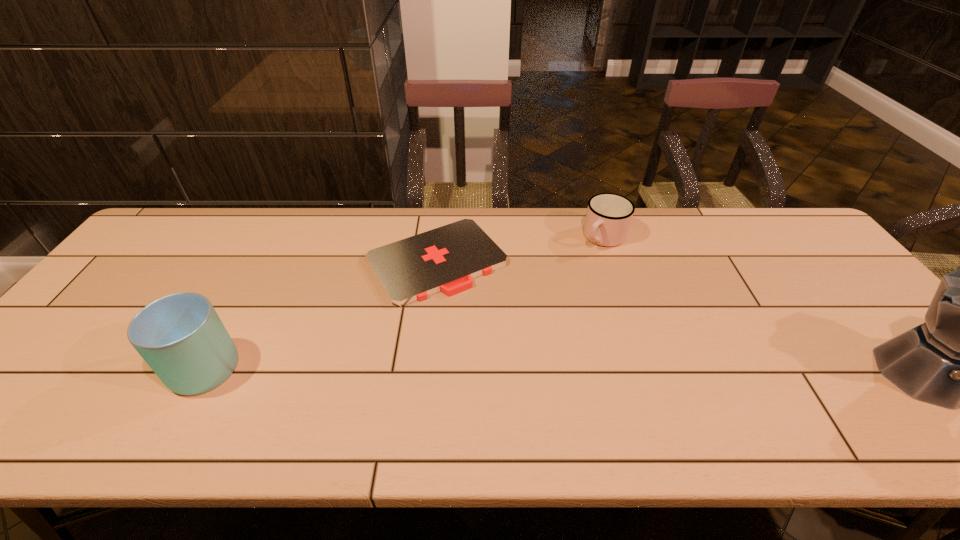
You are a GUI agent. You are given a task and a screenshot of the screen. Output one action in this format:
    pyautogui.click(x=<x>, y=<y>)
    Task: Click on the free space located 0.080m on handle side the first-aid kit
    This screenshot has width=960, height=540.
    Given the screenshot: What is the action you would take?
    pyautogui.click(x=486, y=320)

Locate an element on the screen. free spot located on handle side the first-aid kit is located at coordinates (510, 349).

At what (x,y) coordinates should I click in order to perform the action: click on vacant space situated 0.300m on handle side the first-aid kit. Please return your answer as a coordinate pair (x, y). This screenshot has width=960, height=540. Looking at the image, I should click on (536, 383).

The image size is (960, 540). Identify the location of mug that is positioned at the far edge. (609, 215).

The height and width of the screenshot is (540, 960). I want to click on the first-aid kit at the far edge, so click(x=446, y=259).

At what (x,y) coordinates should I click in order to perform the action: click on object present at the near edge. Please return your answer as a coordinate pair (x, y). Looking at the image, I should click on (180, 336).

Where is `vacant area at the far edge of the desktop`? vacant area at the far edge of the desktop is located at coordinates (370, 229).

Where is `vacant position at the near edge of the desktop`? The image size is (960, 540). vacant position at the near edge of the desktop is located at coordinates (420, 392).

You are a GUI agent. You are given a task and a screenshot of the screen. Output one action in this format:
    pyautogui.click(x=<x>, y=<y>)
    Task: Click on the vacant space at the left edge of the desktop
    The image size is (960, 540).
    Given the screenshot: What is the action you would take?
    pyautogui.click(x=85, y=315)

You are a GUI agent. You are given a task and a screenshot of the screen. Output one action in this format:
    pyautogui.click(x=<x>, y=<y>)
    Task: Click on the blank area at the far left corner
    The width and height of the screenshot is (960, 540).
    Given the screenshot: What is the action you would take?
    pyautogui.click(x=149, y=241)